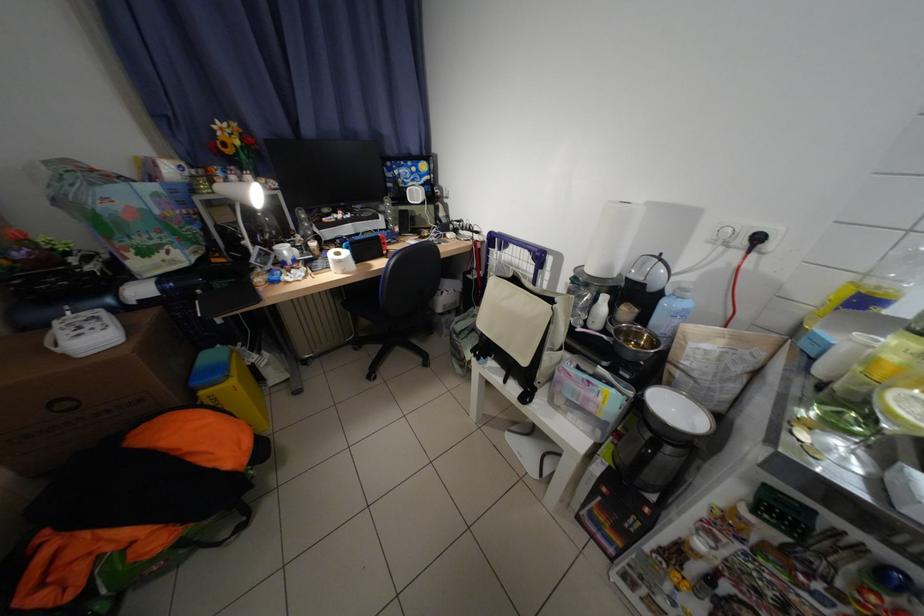
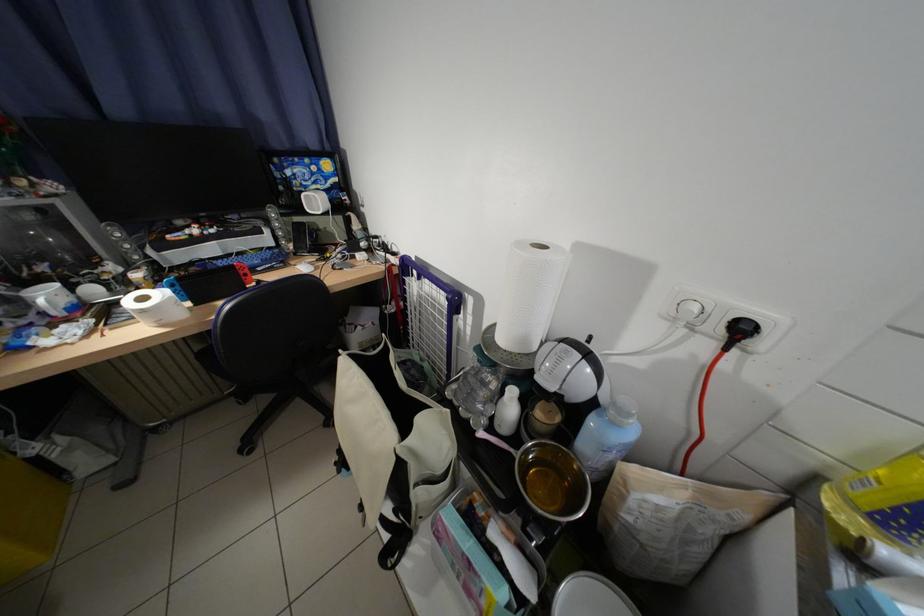
Find the pixel in the second image that matches the point at 602,272 in the first image.

(514, 341)